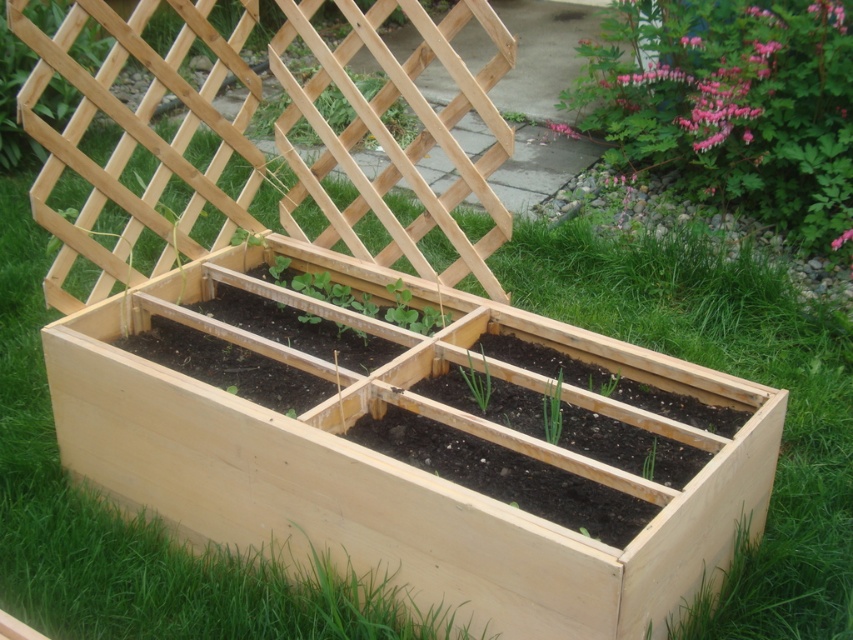
Question: Which object is positioned farthest from the green matte onion at center?

Choices:
 (A) green matte plant at lower right
 (B) green matte plant at center

Answer: (A)

Question: Which object is positioned farthest from the green matte plant at lower right?

Choices:
 (A) green matte plant at center
 (B) green matte trellis at upper center

Answer: (B)

Question: Does pink flower at upper right have a greater width compared to green matte onion at center?

Choices:
 (A) yes
 (B) no

Answer: (A)

Question: Which point is closer to the camera?

Choices:
 (A) pink flower at upper right
 (B) green matte plant at center
 (C) green matte onion at center

Answer: (B)

Question: Can you confirm if pink flower at upper right is positioned to the right of green matte trellis at upper center?

Choices:
 (A) yes
 (B) no

Answer: (A)

Question: Does green matte plant at center appear on the right side of green matte onion at center?

Choices:
 (A) yes
 (B) no

Answer: (A)